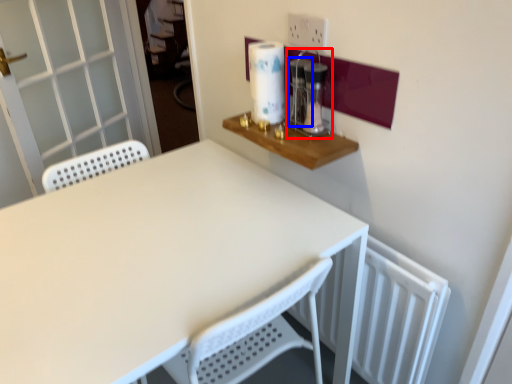
Question: Which of the following is the closest to the observer, coffee machine (highlighted by a red box) or appliance (highlighted by a blue box)?

Choices:
 (A) coffee machine
 (B) appliance

Answer: (A)